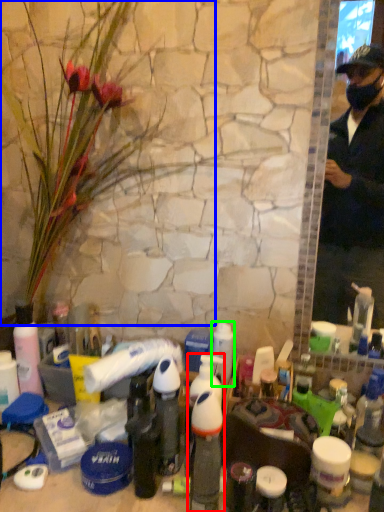
Question: Considering the real-world distances, which object is closest to bottle (highlighted by a red box)? flower (highlighted by a blue box) or toiletry (highlighted by a green box).

Choices:
 (A) flower
 (B) toiletry

Answer: (B)